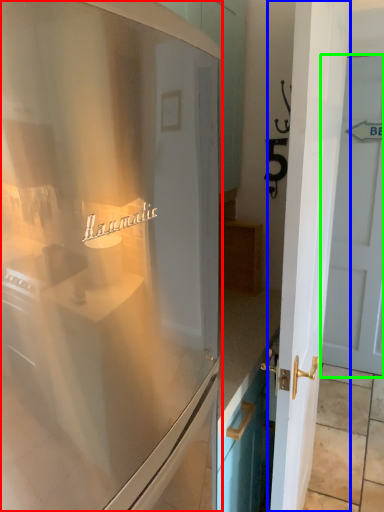
Question: Considering the real-world distances, which object is closest to refrigerator (highlighted by a red box)? door (highlighted by a blue box) or door (highlighted by a green box).

Choices:
 (A) door
 (B) door

Answer: (A)